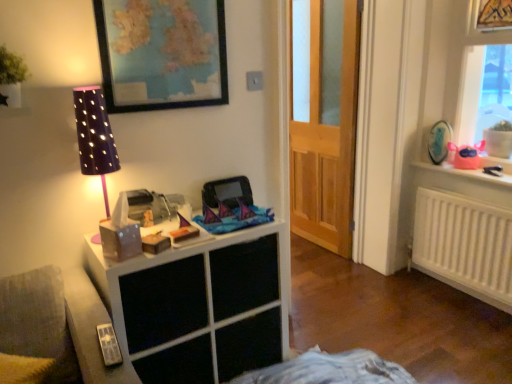
In order to click on vacant space that is to the left of white matte radiator at right in this screenshot , I will do `click(395, 299)`.